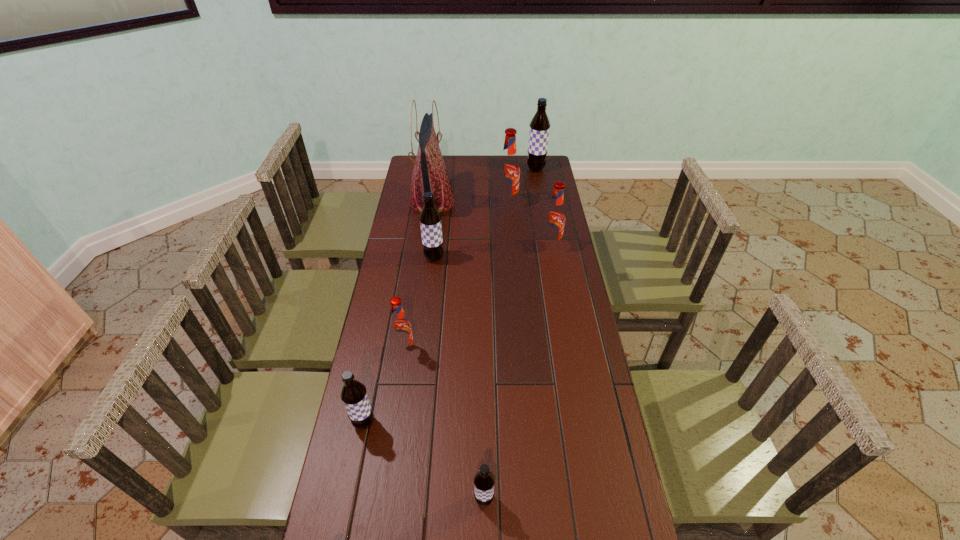
The width and height of the screenshot is (960, 540). Identify the location of the leftmost red root beer. (400, 327).

The image size is (960, 540). I want to click on the second nearest object, so click(x=353, y=394).

The image size is (960, 540). What are the coordinates of `the third farthest brown root beer` in the screenshot? It's located at (353, 394).

Find the location of `the nearest root beer`. the nearest root beer is located at coordinates (484, 480).

This screenshot has width=960, height=540. I want to click on the nearest object, so click(x=484, y=480).

At what (x,y) coordinates should I click in order to perform the action: click on vacant space located on the front of the tallest object. Please return your answer as a coordinate pair (x, y). The width and height of the screenshot is (960, 540). Looking at the image, I should click on (424, 262).

In order to click on free space located 0.110m on the left of the biggest red root beer in this screenshot , I will do `click(473, 203)`.

What are the coordinates of `vacant space located on the front of the farthest root beer` in the screenshot? It's located at (542, 208).

The height and width of the screenshot is (540, 960). I want to click on vacant space located 0.130m on the left of the second biggest red root beer, so click(x=510, y=246).

Image resolution: width=960 pixels, height=540 pixels. Identify the location of free spot located 0.060m on the front of the second farthest brown root beer. (432, 275).